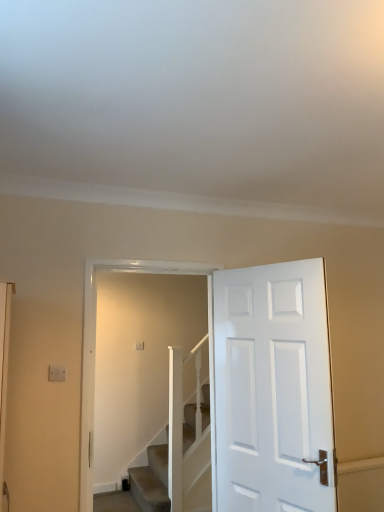
The width and height of the screenshot is (384, 512). What do you see at coordinates (273, 389) in the screenshot? I see `white matte door at right` at bounding box center [273, 389].

Where is `white matte door at right`? This screenshot has width=384, height=512. white matte door at right is located at coordinates (273, 389).

What is the approximate width of white matte door at right?

The width of white matte door at right is 5.26 inches.

The image size is (384, 512). Identify the location of white matte door at right. (273, 389).